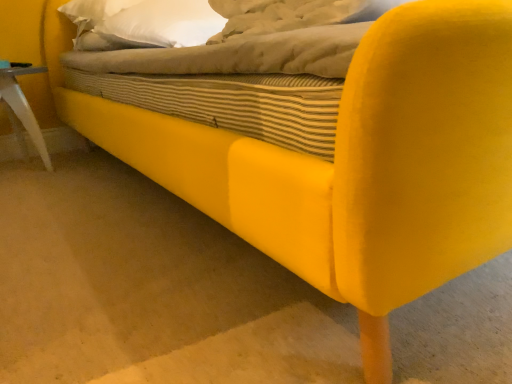
What is the approximate width of white plastic side table at lower left?

white plastic side table at lower left is 15.77 inches in width.

Based on the photo, measure the distance between point [11,117] and camera.

The distance of point [11,117] from camera is 2.05 meters.

This screenshot has height=384, width=512. Describe the element at coordinates (22, 109) in the screenshot. I see `white plastic side table at lower left` at that location.

Where is `white plastic side table at lower left`? The image size is (512, 384). white plastic side table at lower left is located at coordinates (22, 109).

This screenshot has height=384, width=512. Describe the element at coordinates (142, 23) in the screenshot. I see `white soft pillow at upper center` at that location.

You are a GUI agent. You are given a task and a screenshot of the screen. Output one action in this format:
    pyautogui.click(x=<x>, y=<y>)
    Task: Click on the white soft pillow at upper center
    The image size is (512, 384).
    Given the screenshot: What is the action you would take?
    pyautogui.click(x=142, y=23)

Image resolution: width=512 pixels, height=384 pixels. I want to click on white plastic side table at lower left, so click(22, 109).

Is white soft pillow at upper center to the left or to the right of white plastic side table at lower left in the image?

Clearly, white soft pillow at upper center is on the right of white plastic side table at lower left in the image.

Relative to white plastic side table at lower left, is white soft pillow at upper center in front or behind?

Clearly, white soft pillow at upper center is in front of white plastic side table at lower left.

Which is nearer, (168, 3) or (3, 99)?

Point (168, 3)

Based on the photo, from the image's perspective, relative to white plastic side table at lower left, is white soft pillow at upper center above or below?

Clearly, from the image's perspective, white soft pillow at upper center is above white plastic side table at lower left.

From a real-world perspective, which is physically above, white soft pillow at upper center or white plastic side table at lower left?

In real-world perspective, white soft pillow at upper center is above.

Considering the sizes of white soft pillow at upper center and white plastic side table at lower left in the image, is white soft pillow at upper center wider or thinner than white plastic side table at lower left?

Clearly, white soft pillow at upper center has more width compared to white plastic side table at lower left.

Which of these two, white soft pillow at upper center or white plastic side table at lower left, stands shorter?

white soft pillow at upper center.

Considering the sizes of objects white soft pillow at upper center and white plastic side table at lower left in the image provided, who is bigger, white soft pillow at upper center or white plastic side table at lower left?

With larger size is white soft pillow at upper center.

Is white soft pillow at upper center located outside white plastic side table at lower left?

Yes, white soft pillow at upper center is located beyond the bounds of white plastic side table at lower left.

Is white soft pillow at upper center next to white plastic side table at lower left and touching it?

No, white soft pillow at upper center is not touching white plastic side table at lower left.

Is white soft pillow at upper center oriented towards white plastic side table at lower left?

No, white soft pillow at upper center is not turned towards white plastic side table at lower left.

How much distance is there between white soft pillow at upper center and white plastic side table at lower left?

white soft pillow at upper center is 20.79 inches away from white plastic side table at lower left.

The height and width of the screenshot is (384, 512). In order to click on pillow above the white plastic side table at lower left (from the image's perspective) in this screenshot , I will do `click(142, 23)`.

Which is more to the left, white plastic side table at lower left or white soft pillow at upper center?

From the viewer's perspective, white plastic side table at lower left appears more on the left side.

Is white plastic side table at lower left further to camera compared to white soft pillow at upper center?

Yes.

Which is in front, point (15, 82) or point (175, 19)?

The point (175, 19) is in front.

From the image's perspective, which object appears higher, white plastic side table at lower left or white soft pillow at upper center?

white soft pillow at upper center, from the image's perspective.

From a real-world perspective, who is located higher, white plastic side table at lower left or white soft pillow at upper center?

white soft pillow at upper center, from a real-world perspective.

Does white plastic side table at lower left have a lesser width compared to white soft pillow at upper center?

Indeed, white plastic side table at lower left has a lesser width compared to white soft pillow at upper center.

From their relative heights in the image, would you say white plastic side table at lower left is taller or shorter than white soft pillow at upper center?

Clearly, white plastic side table at lower left is taller compared to white soft pillow at upper center.

Which of these two, white plastic side table at lower left or white soft pillow at upper center, is smaller?

white plastic side table at lower left is smaller.

Is white soft pillow at upper center inside white plastic side table at lower left?

Actually, white soft pillow at upper center is outside white plastic side table at lower left.

Is white plastic side table at lower left in contact with white soft pillow at upper center?

No, white plastic side table at lower left is not with white soft pillow at upper center.

Is white plastic side table at lower left positioned with its back to white soft pillow at upper center?

No, white plastic side table at lower left is not facing the opposite direction of white soft pillow at upper center.

Identify the location of pillow that is above the white plastic side table at lower left (from the image's perspective). (142, 23).

In the image, there is a white plastic side table at lower left. Where is `pillow above it (from the image's perspective)`? This screenshot has width=512, height=384. pillow above it (from the image's perspective) is located at coordinates (142, 23).

At what (x,y) coordinates should I click in order to perform the action: click on furniture to the left of white soft pillow at upper center. Please return your answer as a coordinate pair (x, y). This screenshot has height=384, width=512. Looking at the image, I should click on (22, 109).